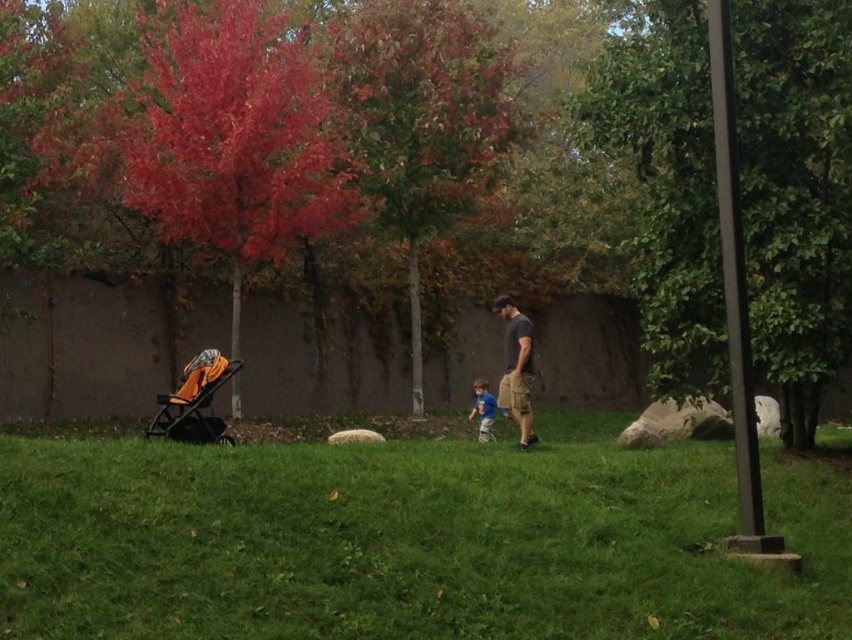
You are standing in the park and want to place a small flag at the point closer to you between the two points marked as point (216, 358) and point (482, 400). Which point should you choose?

You should choose point (216, 358) because it is closer to you than point (482, 400).

You are standing in the park and see the orange fabric baby carriage at lower left and the blue cotton shirt at center. Which object is positioned higher in the image?

The orange fabric baby carriage at lower left is positioned higher than the blue cotton shirt at center.